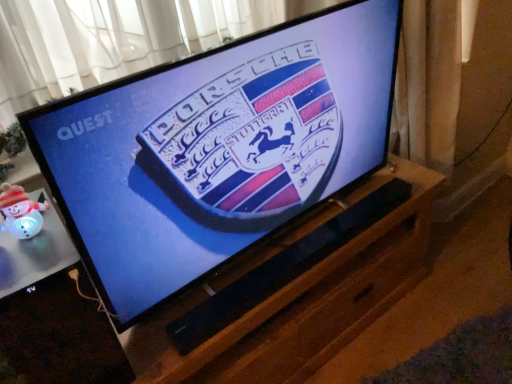
Identify the location of free space above black matte speaker at center (from a real-world perspective). This screenshot has width=512, height=384. (321, 236).